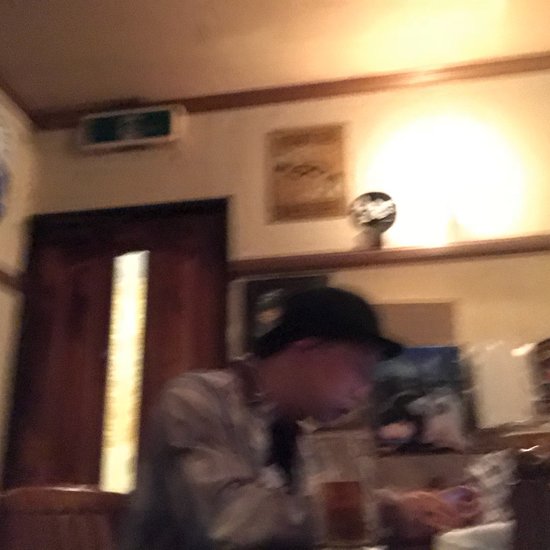
What are the coordinates of `walls` in the screenshot? It's located at (403, 138), (511, 305), (19, 206).